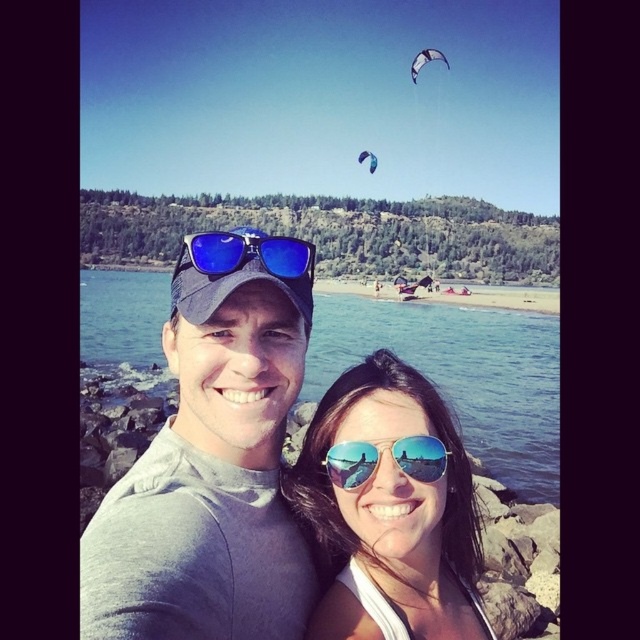
You are a photographer trying to capture the clear blue water at center and the blue reflective sunglasses at center in a single shot. Which object should you focus on first if you want to ensure both are in sharp focus?

The clear blue water at center is located below blue reflective sunglasses at center. To ensure both are in sharp focus, you should focus on the blue reflective sunglasses at center first since it is closer to the camera, allowing the depth of field to cover the water below.

You are a photographer trying to capture a clear shot of both the blue reflective sunglasses at center and the blue glossy kite at upper center. Which object should you focus on first to ensure it appears sharp in the photo?

You should focus on the blue reflective sunglasses at center first because it is closer to the viewer than the blue glossy kite at upper center, ensuring it stays sharp while adjusting focus for the kite.